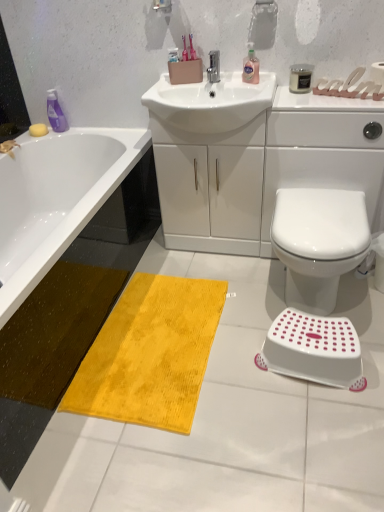
Find the location of a particular element. The height and width of the screenshot is (512, 384). free region on the left part of white glossy toilet at lower right is located at coordinates [245, 307].